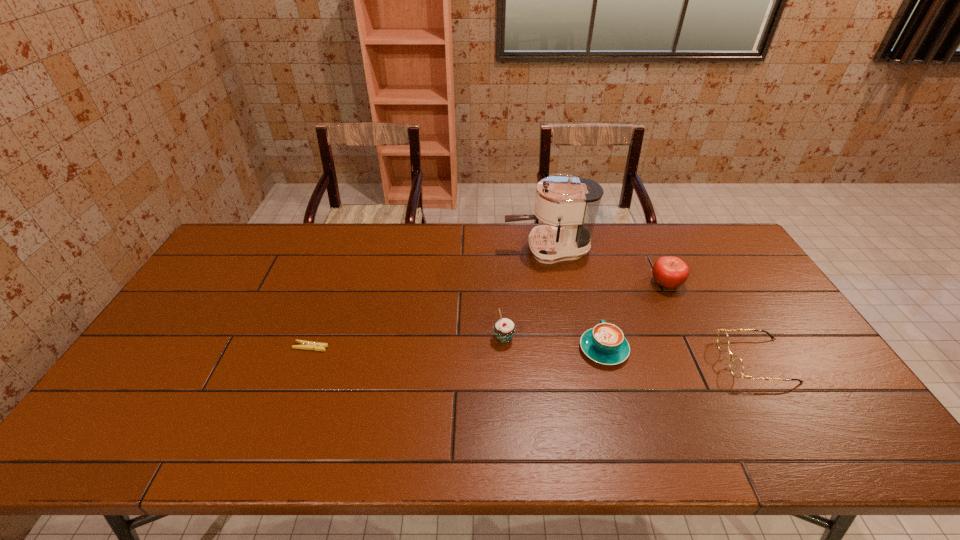
Locate an element on the screen. free point between the cappuccino and the farthest object is located at coordinates (576, 300).

In order to click on vacant point located between the cupcake and the spectacles in this screenshot , I will do `click(630, 349)`.

What are the coordinates of `vacant region between the fifth nearest object and the cupcake` in the screenshot? It's located at (586, 311).

At what (x,y) coordinates should I click in order to perform the action: click on vacant space that is in between the tallest object and the rightmost object. Please return your answer as a coordinate pair (x, y). The height and width of the screenshot is (540, 960). Looking at the image, I should click on (652, 305).

Identify the location of vacant area that lies between the coffee maker and the leftmost object. This screenshot has height=540, width=960. (429, 298).

Locate an element on the screen. vacant area between the cappuccino and the cupcake is located at coordinates (554, 344).

You are a GUI agent. You are given a task and a screenshot of the screen. Output one action in this format:
    pyautogui.click(x=<x>, y=<y>)
    Task: Click on the vacant region between the cappuccino and the cupcake
    The width and height of the screenshot is (960, 540).
    Given the screenshot: What is the action you would take?
    pyautogui.click(x=554, y=344)

The image size is (960, 540). In order to click on blank region between the tallest object and the rightmost object in this screenshot , I will do `click(652, 305)`.

Locate which object ranks in proximity to the leftmost object. Please provide its 2D coordinates. Your answer should be formatted as a tuple, i.e. [(x, y)], where the tuple contains the x and y coordinates of a point satisfying the conditions above.

[(504, 329)]

At what (x,y) coordinates should I click in order to perform the action: click on object that can be found as the second closest to the shortest object. Please return your answer as a coordinate pair (x, y). The height and width of the screenshot is (540, 960). Looking at the image, I should click on (571, 202).